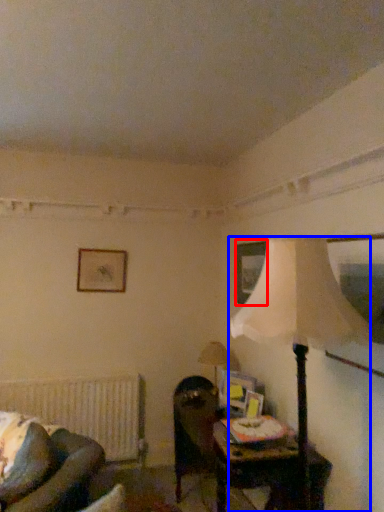
Question: Which object appears farthest to the camera in this image, picture frame (highlighted by a red box) or lamp (highlighted by a blue box)?

Choices:
 (A) picture frame
 (B) lamp

Answer: (A)